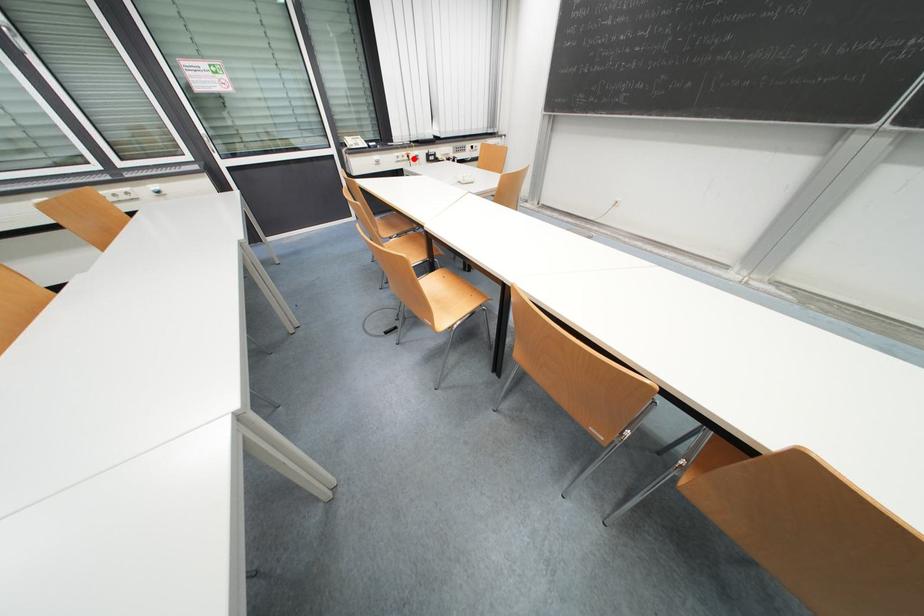
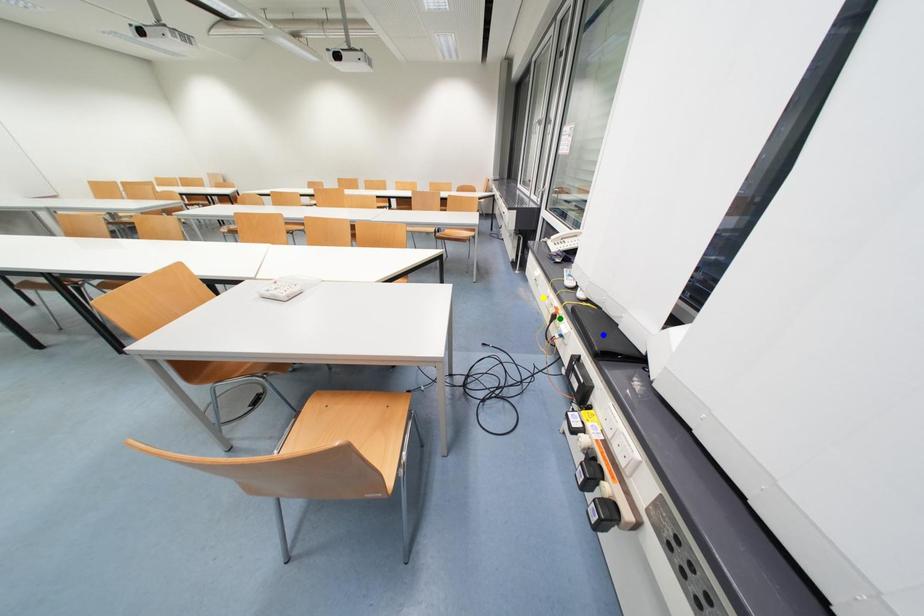
Question: I am providing you with two images of the same scene from different viewpoints. A red point is marked on the first image. You are given multiple points on the second image. In image 2, which mark is for the same physical point as the one in image 1?

Choices:
 (A) yellow point
 (B) blue point
 (C) green point

Answer: (C)